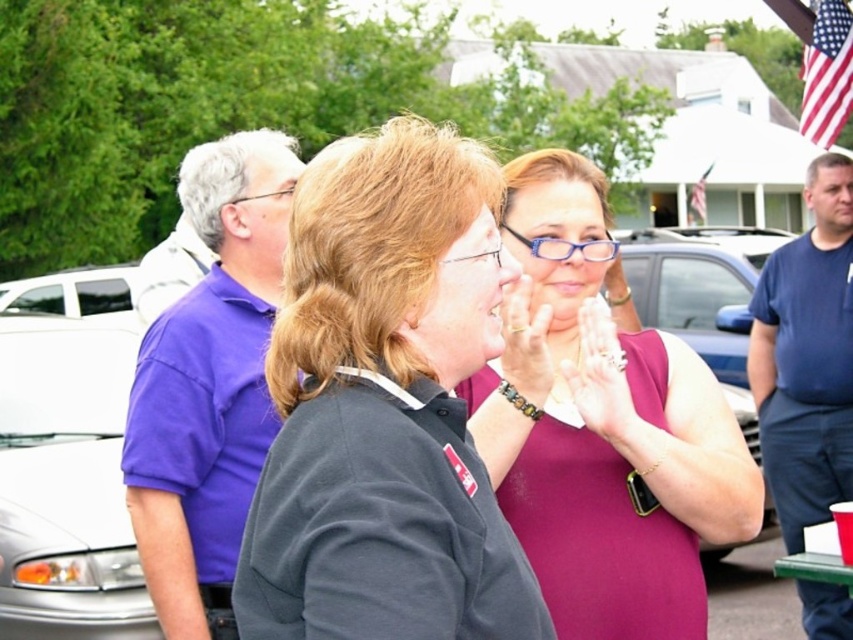
Question: Which of the following is the farthest from the observer?

Choices:
 (A) dark gray shirt at center
 (B) purple cotton polo shirt at left
 (C) matte gold ring at center
 (D) dark blue t-shirt at right

Answer: (D)

Question: Observing the image, what is the correct spatial positioning of dark gray shirt at center in reference to dark blue t-shirt at right?

Choices:
 (A) below
 (B) above

Answer: (B)

Question: Which of these objects is positioned closest to the smooth skin hands at center?

Choices:
 (A) purple satin dress at center
 (B) matte gold ring at center
 (C) purple cotton polo shirt at left
 (D) dark blue t-shirt at right

Answer: (B)

Question: Estimate the real-world distances between objects in this image. Which object is farther from the dark blue t-shirt at right?

Choices:
 (A) purple satin dress at center
 (B) dark gray shirt at center
 (C) purple cotton polo shirt at left
 (D) matte gold ring at center

Answer: (B)

Question: Can you confirm if purple cotton polo shirt at left is positioned to the left of matte gold ring at center?

Choices:
 (A) yes
 (B) no

Answer: (A)

Question: From the image, what is the correct spatial relationship of dark blue t-shirt at right in relation to smooth skin hands at center?

Choices:
 (A) left
 (B) right

Answer: (B)